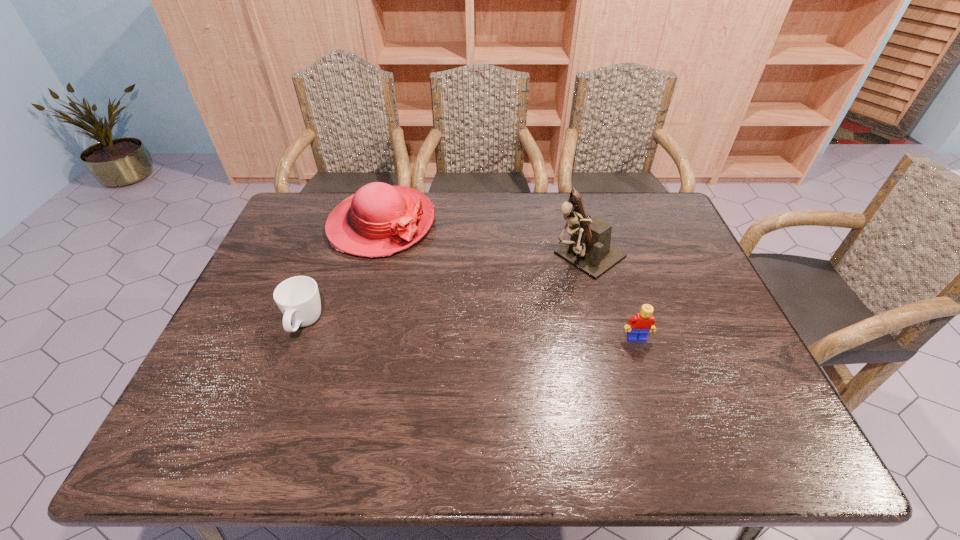
Locate an element on the screen. This screenshot has height=540, width=960. vacant space at the right edge of the desktop is located at coordinates (685, 246).

In the image, there is a desktop. Where is `vacant space at the far left corner`? Image resolution: width=960 pixels, height=540 pixels. vacant space at the far left corner is located at coordinates [327, 195].

Find the location of `vacant region at the near left corner of the desktop`. vacant region at the near left corner of the desktop is located at coordinates (223, 380).

In order to click on free point between the cup and the figurine in this screenshot , I will do `click(445, 290)`.

Where is `unoccupied area between the cup and the second tallest object`? unoccupied area between the cup and the second tallest object is located at coordinates (343, 274).

Identify the location of vacant area between the Lego and the figurine. (612, 297).

At what (x,y) coordinates should I click in order to perform the action: click on free point between the Lego and the cup. Please return your answer as a coordinate pair (x, y). Looking at the image, I should click on (470, 332).

The height and width of the screenshot is (540, 960). What are the coordinates of `free area in between the Lego and the cup` in the screenshot? It's located at (470, 332).

Identify the location of free point between the tallest object and the Lego. The width and height of the screenshot is (960, 540). (612, 297).

At what (x,y) coordinates should I click in order to perform the action: click on empty space that is in between the Lego and the tallest object. Please return your answer as a coordinate pair (x, y). The width and height of the screenshot is (960, 540). Looking at the image, I should click on (612, 297).